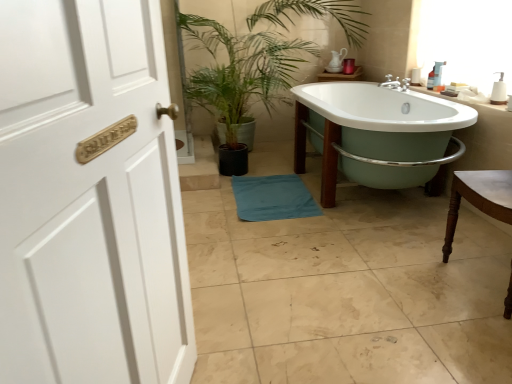
Question: From the image's perspective, is white ceramic sink at upper right on top of brown wooden chair at right?

Choices:
 (A) no
 (B) yes

Answer: (B)

Question: From the image's perspective, does white ceramic sink at upper right appear lower than brown wooden chair at right?

Choices:
 (A) no
 (B) yes

Answer: (A)

Question: From a real-world perspective, is white ceramic sink at upper right over brown wooden chair at right?

Choices:
 (A) yes
 (B) no

Answer: (A)

Question: Is white ceramic sink at upper right shorter than brown wooden chair at right?

Choices:
 (A) yes
 (B) no

Answer: (A)

Question: Is white ceramic sink at upper right at the right side of brown wooden chair at right?

Choices:
 (A) no
 (B) yes

Answer: (B)

Question: Considering the positions of white ceramic sink at upper right and white porcelain bathtub at center in the image, is white ceramic sink at upper right taller or shorter than white porcelain bathtub at center?

Choices:
 (A) tall
 (B) short

Answer: (B)

Question: Considering the positions of white ceramic sink at upper right and white porcelain bathtub at center in the image, is white ceramic sink at upper right wider or thinner than white porcelain bathtub at center?

Choices:
 (A) thin
 (B) wide

Answer: (A)

Question: Is point coord(487,104) closer or farther from the camera than point coord(395,109)?

Choices:
 (A) closer
 (B) farther

Answer: (A)

Question: Visually, is white ceramic sink at upper right positioned to the left or to the right of white porcelain bathtub at center?

Choices:
 (A) right
 (B) left

Answer: (A)

Question: From a real-world perspective, is blue fabric bath towel at center above or below white ceramic sink at upper right?

Choices:
 (A) below
 (B) above

Answer: (A)

Question: Relative to white ceramic sink at upper right, is blue fabric bath towel at center in front or behind?

Choices:
 (A) behind
 (B) front

Answer: (A)

Question: From the image's perspective, relative to white ceramic sink at upper right, is blue fabric bath towel at center above or below?

Choices:
 (A) above
 (B) below

Answer: (B)

Question: Based on their sizes in the image, would you say blue fabric bath towel at center is bigger or smaller than white ceramic sink at upper right?

Choices:
 (A) small
 (B) big

Answer: (B)

Question: From the image's perspective, is blue fabric bath towel at center located above or below green glossy plant at center?

Choices:
 (A) below
 (B) above

Answer: (A)

Question: Considering the positions of blue fabric bath towel at center and green glossy plant at center in the image, is blue fabric bath towel at center taller or shorter than green glossy plant at center?

Choices:
 (A) tall
 (B) short

Answer: (B)